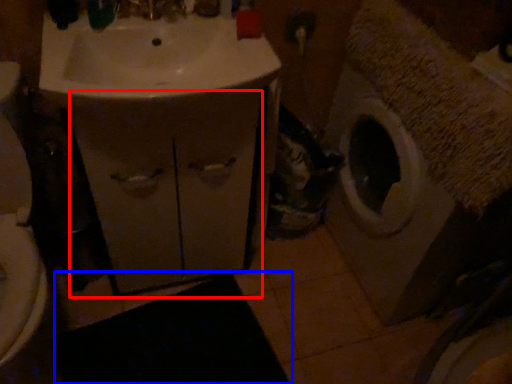
Question: Among these objects, which one is nearest to the camera, drawer (highlighted by a red box) or bath mat (highlighted by a blue box)?

Choices:
 (A) drawer
 (B) bath mat

Answer: (A)